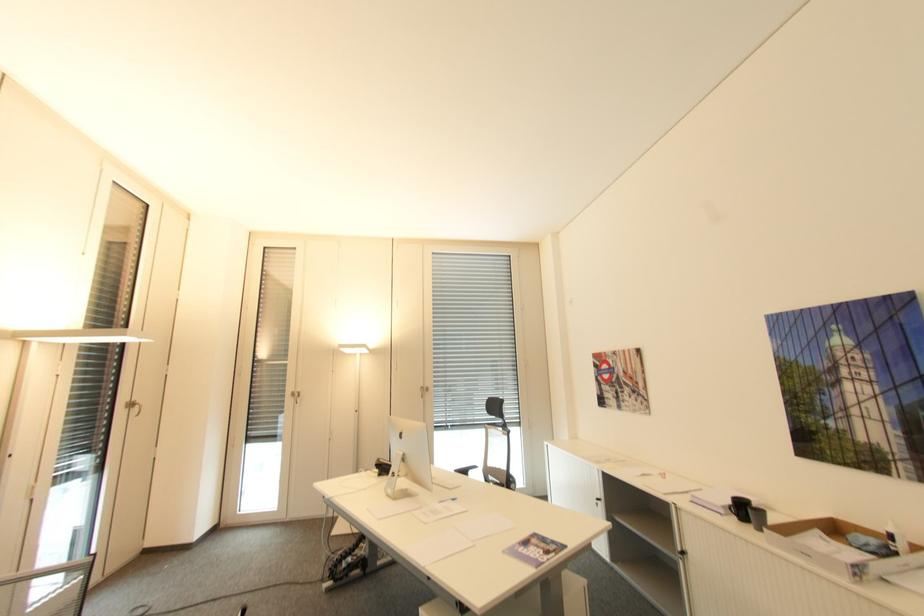
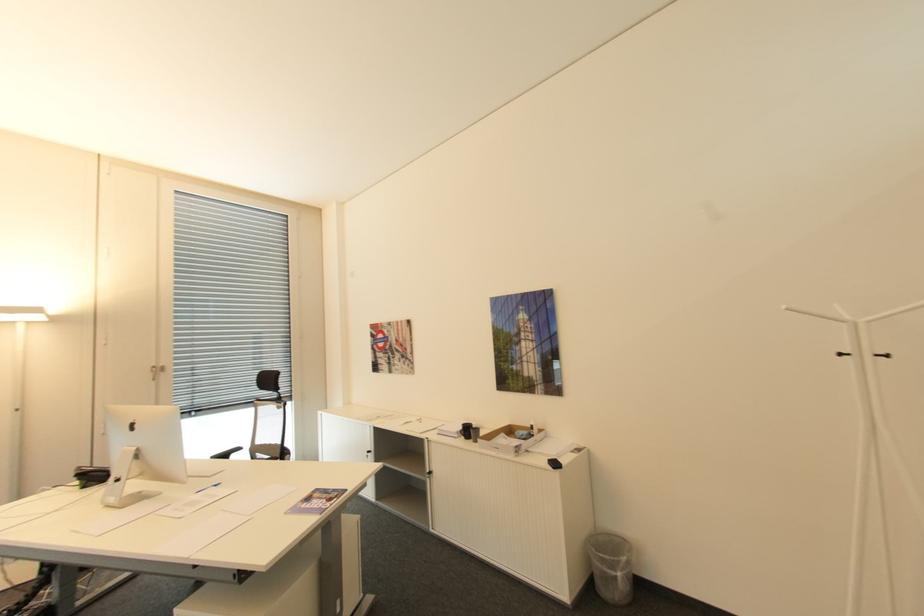
The point at (x=505, y=419) is marked in the first image. Where is the corresponding point in the second image?

(280, 392)